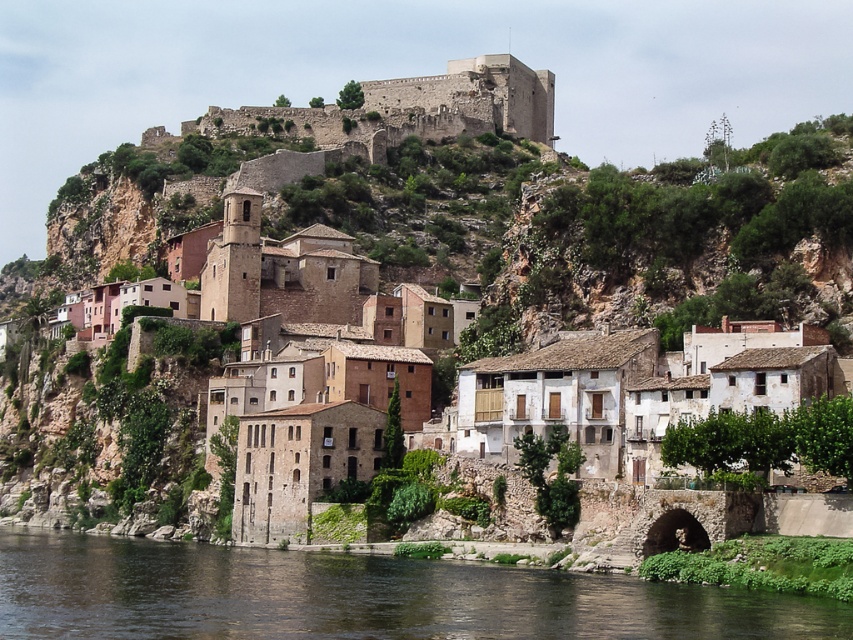
Is dark brown water at lower center bigger than beige stone houses at center?

Actually, dark brown water at lower center might be smaller than beige stone houses at center.

Is the position of dark brown water at lower center less distant than that of beige stone houses at center?

That is True.

Between point (247, 564) and point (419, 365), which one is positioned behind?

Point (419, 365)

Where is `dark brown water at lower center`? This screenshot has height=640, width=853. dark brown water at lower center is located at coordinates (358, 596).

Does dark brown water at lower center appear under rustic stone castle at upper center?

Indeed, dark brown water at lower center is positioned under rustic stone castle at upper center.

Which is above, dark brown water at lower center or rustic stone castle at upper center?

rustic stone castle at upper center

This screenshot has height=640, width=853. What do you see at coordinates (358, 596) in the screenshot?
I see `dark brown water at lower center` at bounding box center [358, 596].

What are the coordinates of `dark brown water at lower center` in the screenshot? It's located at (358, 596).

Does beige stone houses at center have a greater width compared to rustic stone castle at upper center?

Correct, the width of beige stone houses at center exceeds that of rustic stone castle at upper center.

Can you confirm if beige stone houses at center is positioned below rustic stone castle at upper center?

Correct, beige stone houses at center is located below rustic stone castle at upper center.

What do you see at coordinates (56, 429) in the screenshot? I see `beige stone houses at center` at bounding box center [56, 429].

Where is `beige stone houses at center`? The image size is (853, 640). beige stone houses at center is located at coordinates (56, 429).